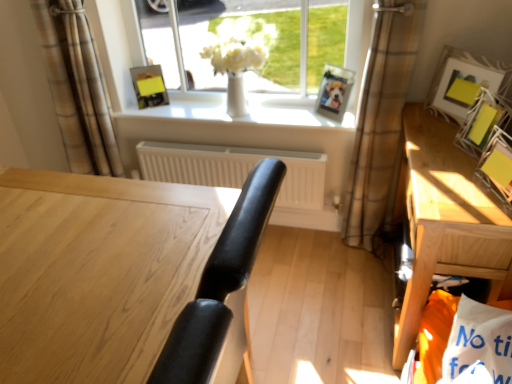
Measure the distance between brown plaid curtain at upper left, marked as the first curtain in a left-to-right arrangement, and camera.

A distance of 1.89 meters exists between brown plaid curtain at upper left, marked as the first curtain in a left-to-right arrangement, and camera.

Describe the element at coordinates (77, 87) in the screenshot. The image size is (512, 384). I see `brown plaid curtain at upper left, marked as the first curtain in a left-to-right arrangement` at that location.

This screenshot has width=512, height=384. Describe the element at coordinates (234, 169) in the screenshot. I see `white matte radiator at center` at that location.

The height and width of the screenshot is (384, 512). What do you see at coordinates (248, 71) in the screenshot? I see `white glossy vase at center` at bounding box center [248, 71].

Measure the distance between point [354,43] and camera.

Point [354,43] and camera are 1.99 meters apart.

Based on the photo, how much space does brown plaid curtain at center right, which is the first curtain from right to left, occupy vertically?

It is 4.01 feet.

This screenshot has height=384, width=512. Describe the element at coordinates (247, 110) in the screenshot. I see `white glossy window sill at center` at that location.

Find the location of a particular element. This screenshot has width=512, height=384. wooden photo frame at upper center, the 2th picture frame when ordered from left to right is located at coordinates (334, 92).

Based on the photo, from the image's perspective, which one is positioned higher, wooden photo frame at upper center, arranged as the 4th picture frame when viewed from the front, or yellow paper at upper right, the fifth picture frame viewed from the left?

wooden photo frame at upper center, arranged as the 4th picture frame when viewed from the front, from the image's perspective.

Is there a large distance between wooden photo frame at upper center, the 2th picture frame when ordered from left to right, and yellow paper at upper right, which is counted as the fifth picture frame, starting from the back?

They are positioned close to each other.

Locate an element on the screen. the 1st picture frame below the yellow paper at upper right, the fifth picture frame viewed from the left (from a real-world perspective) is located at coordinates (334, 92).

Considering the points (3, 281) and (90, 104), which point is in front, point (3, 281) or point (90, 104)?

Point (3, 281)

Can you confirm if wooden desk at center is smaller than brown plaid curtain at upper left, which is counted as the 2th curtain, starting from the right?

No, wooden desk at center is not smaller than brown plaid curtain at upper left, which is counted as the 2th curtain, starting from the right.

What's the angular difference between wooden desk at center and brown plaid curtain at upper left, which is counted as the 2th curtain, starting from the right,'s facing directions?

wooden desk at center and brown plaid curtain at upper left, which is counted as the 2th curtain, starting from the right, are facing 92.8 degrees away from each other.

Does point (223, 146) appear closer or farther from the camera than point (145, 94)?

Point (223, 146) is closer to the camera than point (145, 94).

Is white matte radiator at center turned away from matte yellow picture frame at upper center, arranged as the 1th picture frame when viewed from the back?

white matte radiator at center does not have its back to matte yellow picture frame at upper center, arranged as the 1th picture frame when viewed from the back.

Considering the sizes of white matte radiator at center and matte yellow picture frame at upper center, which appears as the first picture frame when viewed from the left, in the image, is white matte radiator at center wider or thinner than matte yellow picture frame at upper center, which appears as the first picture frame when viewed from the left,?

In the image, white matte radiator at center appears to be wider than matte yellow picture frame at upper center, which appears as the first picture frame when viewed from the left.

What's the angular difference between yellow paper at upper right, the first picture frame positioned from the right, and wooden desk at center's facing directions?

The angular difference between yellow paper at upper right, the first picture frame positioned from the right, and wooden desk at center is 14.1 degrees.

Which point is more distant from viewer, (510, 181) or (156, 299)?

The point (510, 181) is more distant.

Where is `the 4th picture frame to the right of the wooden desk at center, starting your count from the anchor`? the 4th picture frame to the right of the wooden desk at center, starting your count from the anchor is located at coordinates (497, 164).

Is wooden table at right not close to matte yellow picture frame at right, marked as the 2th picture frame in a front-to-back arrangement?

No, wooden table at right is not far away from matte yellow picture frame at right, marked as the 2th picture frame in a front-to-back arrangement.

Is wooden table at right taller than matte yellow picture frame at right, marked as the 2th picture frame in a front-to-back arrangement?

Correct, wooden table at right is much taller as matte yellow picture frame at right, marked as the 2th picture frame in a front-to-back arrangement.

Is wooden table at right oriented towards matte yellow picture frame at right, the fourth picture frame from the back?

No, wooden table at right is not facing towards matte yellow picture frame at right, the fourth picture frame from the back.

Considering the relative positions of wooden table at right and matte yellow picture frame at right, the fourth picture frame viewed from the left, in the image provided, is wooden table at right to the left or to the right of matte yellow picture frame at right, the fourth picture frame viewed from the left,?

wooden table at right is positioned on matte yellow picture frame at right, the fourth picture frame viewed from the left,'s left side.

Looking at this image, can you confirm if wooden table at right is shorter than white matte radiator at center?

No.

Would you say wooden table at right is inside or outside white matte radiator at center?

wooden table at right cannot be found inside white matte radiator at center.

Measure the distance between wooden table at right and white matte radiator at center.

wooden table at right and white matte radiator at center are 32.14 inches apart from each other.

Which is in front, wooden table at right or white matte radiator at center?

wooden table at right.

Is yellow paper at upper right, the first picture frame positioned from the right, shorter than wooden table at right?

Yes, yellow paper at upper right, the first picture frame positioned from the right, is shorter than wooden table at right.

From the image's perspective, relative to wooden table at right, is yellow paper at upper right, the fifth picture frame viewed from the left, above or below?

yellow paper at upper right, the fifth picture frame viewed from the left, is situated higher than wooden table at right in the image.

Considering their positions, is yellow paper at upper right, the fifth picture frame viewed from the left, located in front of or behind wooden table at right?

yellow paper at upper right, the fifth picture frame viewed from the left, is positioned closer to the viewer than wooden table at right.

Identify the location of the 3rd picture frame in front of the wooden photo frame at upper center, the 2th picture frame viewed from the back. (497, 164).

Where is `curtain on the left of wooden desk at center`? The width and height of the screenshot is (512, 384). curtain on the left of wooden desk at center is located at coordinates (77, 87).

From the image, which object appears to be nearer to matte yellow picture frame at right, the fourth picture frame viewed from the left, white glossy window sill at center or white matte radiator at center?

Among the two, white glossy window sill at center is located nearer to matte yellow picture frame at right, the fourth picture frame viewed from the left.

Considering their positions, is wooden table at right positioned closer to matte yellow picture frame at upper center, positioned as the fifth picture frame in right-to-left order, than white glossy window sill at center?

The object closer to matte yellow picture frame at upper center, positioned as the fifth picture frame in right-to-left order, is white glossy window sill at center.

When comparing their distances from matte yellow picture frame at right, the 2th picture frame when ordered from right to left, does white matte radiator at center or wooden table at right seem further?

white matte radiator at center is positioned further to the anchor matte yellow picture frame at right, the 2th picture frame when ordered from right to left.

In the scene shown: When comparing their distances from white glossy window sill at center, does wooden desk at center or yellow paper at upper right, which is counted as the fifth picture frame, starting from the back, seem further?

Based on the image, wooden desk at center appears to be further to white glossy window sill at center.

Considering their positions, is brown plaid curtain at upper left, marked as the first curtain in a left-to-right arrangement, positioned further to wooden photo frame at upper center, which appears as the 4th picture frame when viewed from the right, than brown plaid curtain at center right, which is the first curtain from right to left?

brown plaid curtain at upper left, marked as the first curtain in a left-to-right arrangement, lies further to wooden photo frame at upper center, which appears as the 4th picture frame when viewed from the right, than the other object.

Based on their spatial positions, is white matte radiator at center or wooden photo frame at upper center, arranged as the 4th picture frame when viewed from the front, further from wooden table at right?

Based on the image, white matte radiator at center appears to be further to wooden table at right.

Looking at the image, which one is located closer to matte yellow picture frame at right, marked as the 2th picture frame in a front-to-back arrangement, matte white picture frame at upper right, the 3th picture frame when ordered from front to back, or wooden table at right?

Among the two, matte white picture frame at upper right, the 3th picture frame when ordered from front to back, is located nearer to matte yellow picture frame at right, marked as the 2th picture frame in a front-to-back arrangement.

Based on their spatial positions, is white glossy vase at center or matte yellow picture frame at upper center, which appears as the first picture frame when viewed from the left, further from yellow paper at upper right, which is counted as the fifth picture frame, starting from the back?

Based on the image, matte yellow picture frame at upper center, which appears as the first picture frame when viewed from the left, appears to be further to yellow paper at upper right, which is counted as the fifth picture frame, starting from the back.

At what (x,y) coordinates should I click in order to perform the action: click on table between yellow paper at upper right, the 1th picture frame from the front, and wooden photo frame at upper center, arranged as the 4th picture frame when viewed from the front, in the front-back direction. Please return your answer as a coordinate pair (x, y). Looking at the image, I should click on (446, 221).

Where is `window sill situated between brown plaid curtain at upper left, marked as the first curtain in a left-to-right arrangement, and matte yellow picture frame at right, the fourth picture frame from the back, from left to right`? window sill situated between brown plaid curtain at upper left, marked as the first curtain in a left-to-right arrangement, and matte yellow picture frame at right, the fourth picture frame from the back, from left to right is located at coordinates (247, 110).

The image size is (512, 384). In order to click on window between wooden desk at center and matte yellow picture frame at upper center, arranged as the 1th picture frame when viewed from the back, from front to back in this screenshot , I will do `click(248, 71)`.

This screenshot has width=512, height=384. In order to click on window between white matte radiator at center and matte white picture frame at upper right, which appears as the third picture frame when viewed from the left, from left to right in this screenshot , I will do `click(248, 71)`.